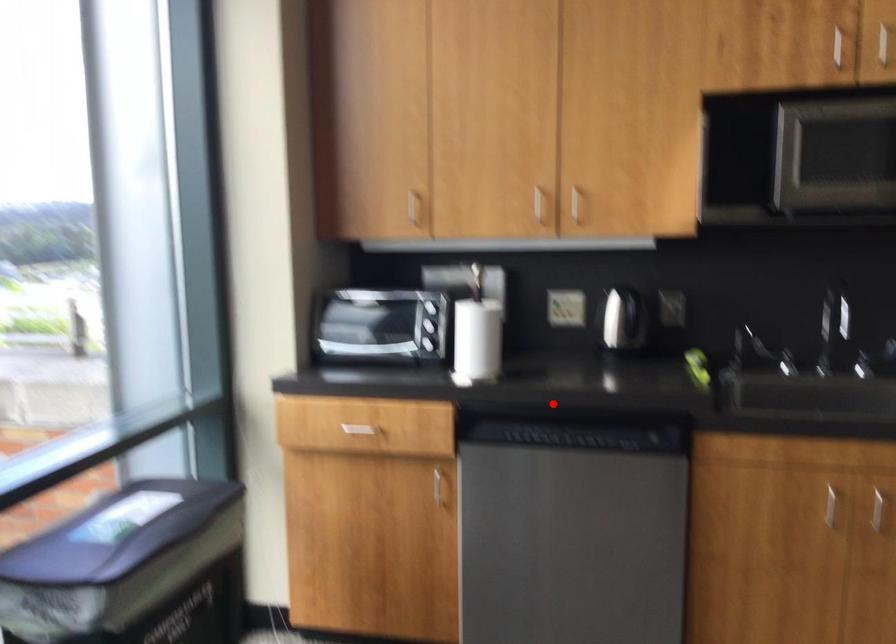
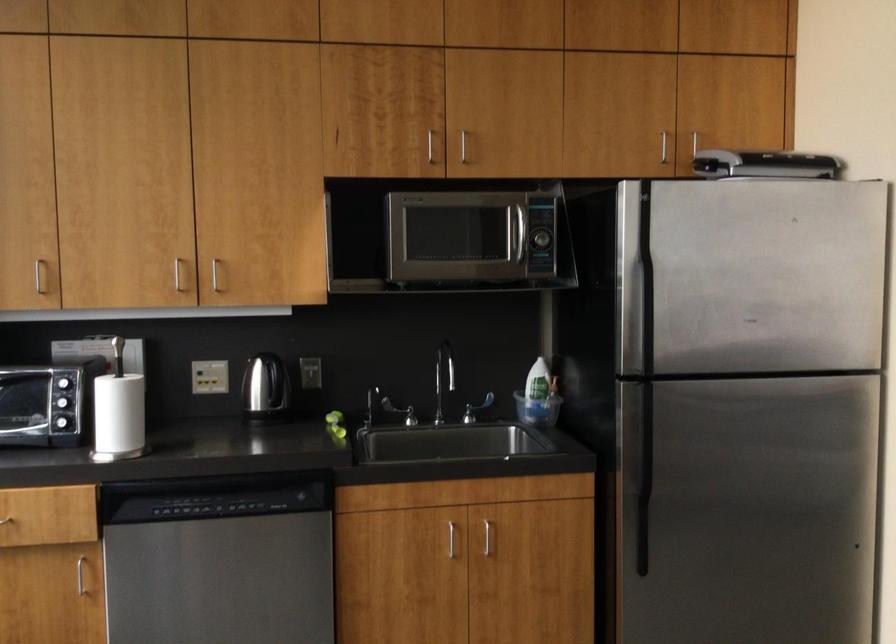
Find the pixel in the second image that matches the highlighted location in the first image.

(208, 471)